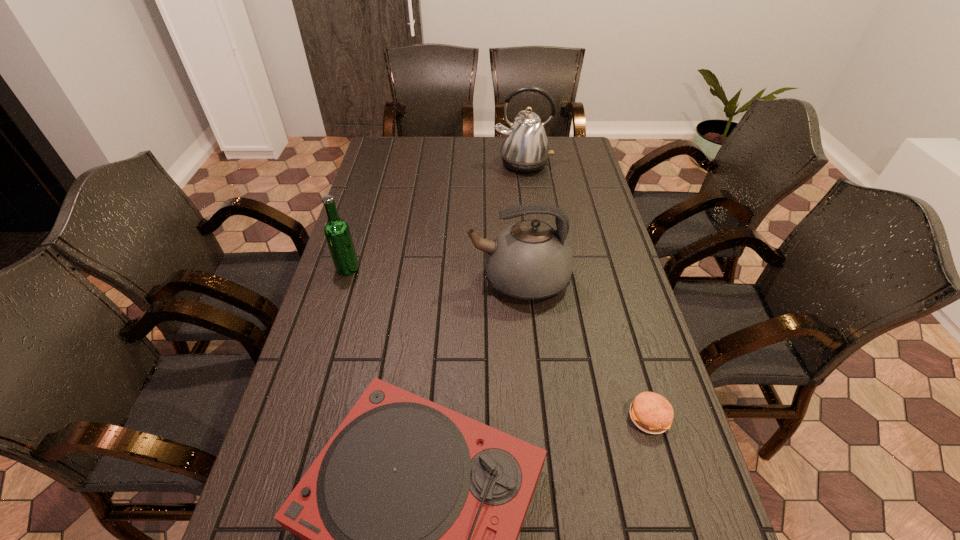
I want to click on vacant space located 0.200m on the front of the rightmost object, so click(684, 536).

The width and height of the screenshot is (960, 540). I want to click on object that is at the far edge, so click(525, 149).

This screenshot has width=960, height=540. I want to click on object located in the left edge section of the desktop, so click(337, 232).

Identify the location of kettle present at the right edge. (525, 149).

I want to click on hamburger positioned at the right edge, so click(x=652, y=413).

I want to click on object situated at the far right corner, so click(x=525, y=149).

Where is `free space at the far edge of the desktop`? free space at the far edge of the desktop is located at coordinates (430, 163).

At what (x,y) coordinates should I click in order to perform the action: click on blank space at the left edge of the desktop. Please return your answer as a coordinate pair (x, y). The image size is (960, 540). Looking at the image, I should click on (374, 239).

The image size is (960, 540). I want to click on vacant space at the right edge, so click(x=570, y=187).

Identify the location of free space at the far left corner of the desktop. click(x=398, y=143).